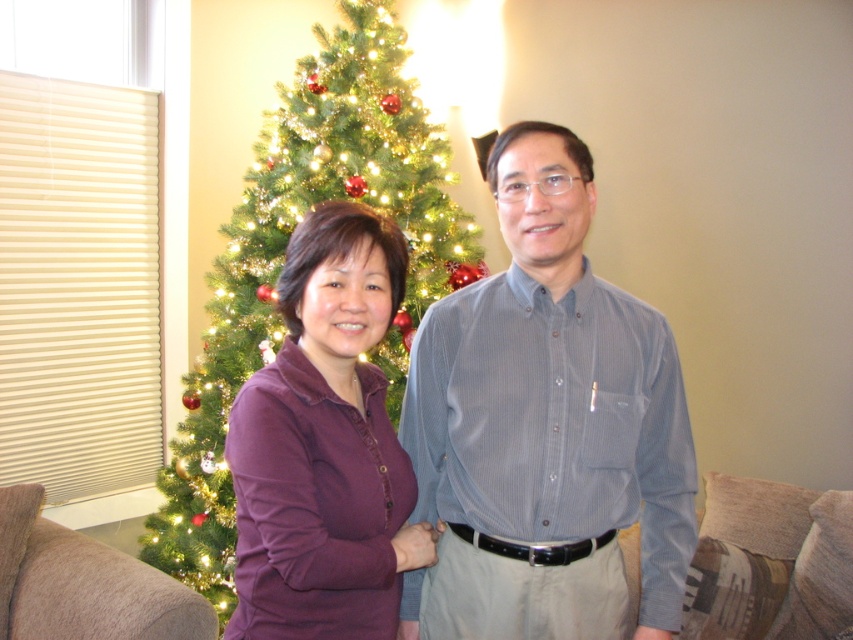
You are organizing a charity clothing drive and need to determine which of the two shirts, the blue striped shirt at center or the purple cotton shirt at center, can fit into a donation box that has a minimum size requirement of 12 inches in length. Which shirt meets the requirement?

The blue striped shirt at center has a larger size compared to the purple cotton shirt at center, so it likely meets the minimum size requirement of 12 inches in length for the donation box.

In the scene shown: You are a photographer trying to capture a group photo of the blue striped shirt at center and the beige upholstered couch in the foreground. Where should you position yourself to ensure both subjects are in frame?

To capture both the blue striped shirt at center and the beige upholstered couch in the foreground, position yourself in a central area facing towards the blue striped shirt at center. This ensures the couch, located in the foreground, remains within the frame while the blue striped shirt at center is centered.

You are standing at point (270, 445) and want to walk to point (531, 440). According to the scene description, will you be moving towards the Christmas tree or away from it?

Since point (531, 440) is behind point (270, 445), moving from point (270, 445) to point (531, 440) means you are moving towards the Christmas tree.